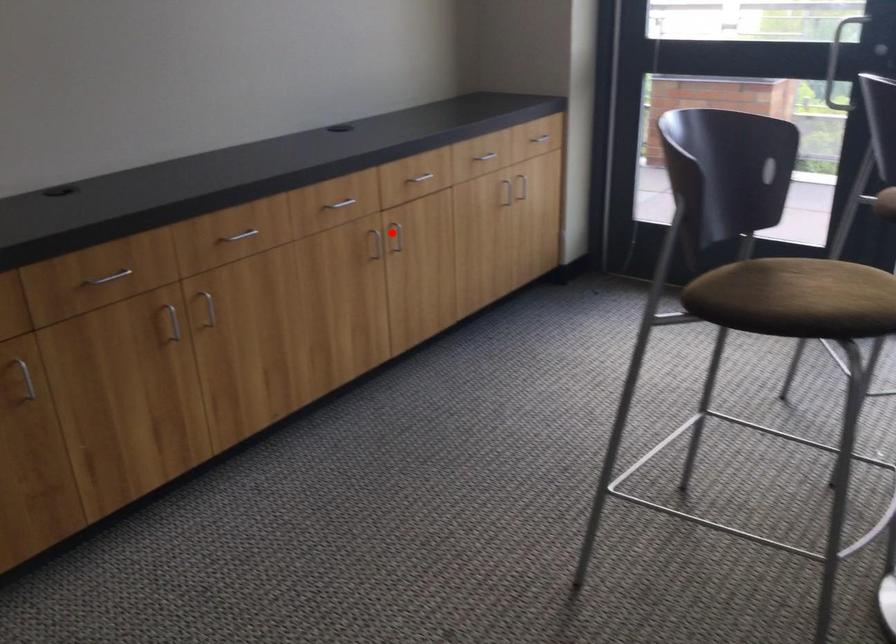
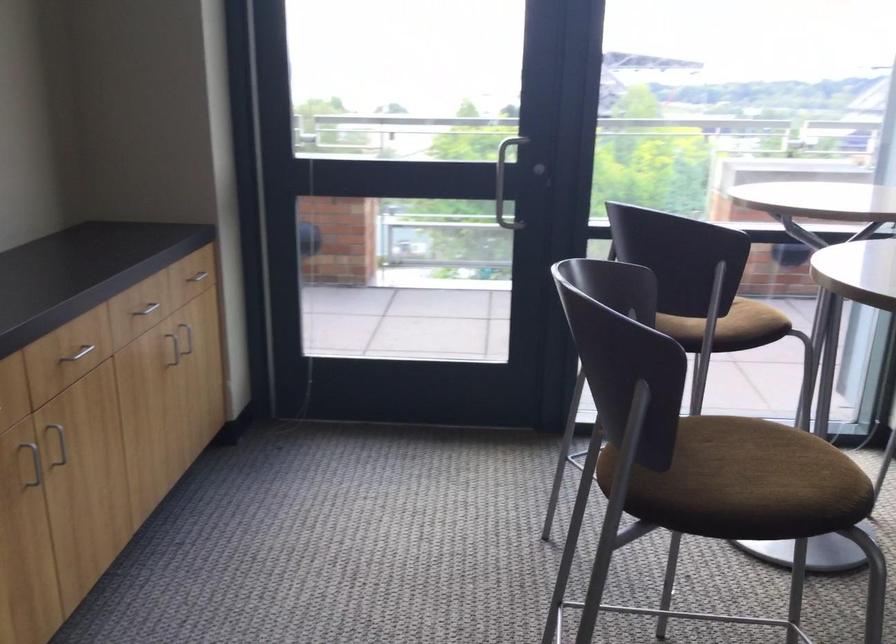
Find the pixel in the second image that matches the highlighted location in the first image.

(57, 442)